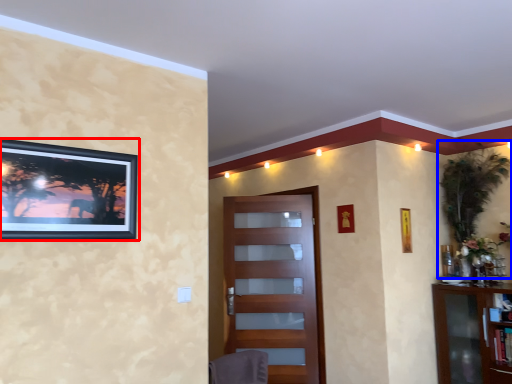
Question: Which point is further to the camera, picture frame (highlighted by a red box) or plant (highlighted by a blue box)?

Choices:
 (A) picture frame
 (B) plant

Answer: (B)